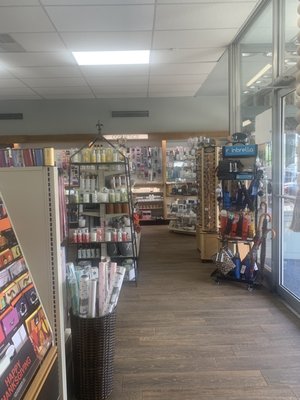
Locate an element on the screen. door handle is located at coordinates (279, 195).